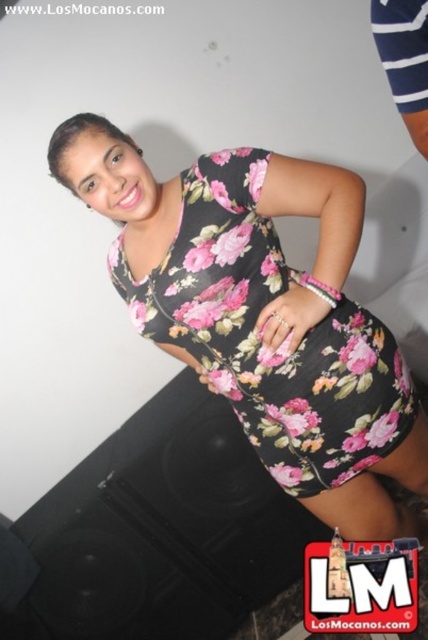
You are a photographer adjusting the focus on your camera. You have two points to focus on in the image, point 1 at point (235, 346) and point 2 at point (413, 1). Which point should you focus on to ensure the subject is in clear view?

Point 1 at point (235, 346) is further to the camera than point 2 at point (413, 1), so focusing on point 1 would ensure the subject is in clear view.

You are a fashion designer observing the image. You need to determine which fabric is higher in the composition. Which one is taller between the floral print fabric dress at center and the white striped fabric at upper right?

The floral print fabric dress at center is much taller than the white striped fabric at upper right.

You are a fashion designer trying to create a new outfit. You have two fabric options in front of you, the floral print fabric dress at center and the white striped fabric at upper right. Which fabric is wider?

The floral print fabric dress at center might be wider than white striped fabric at upper right.